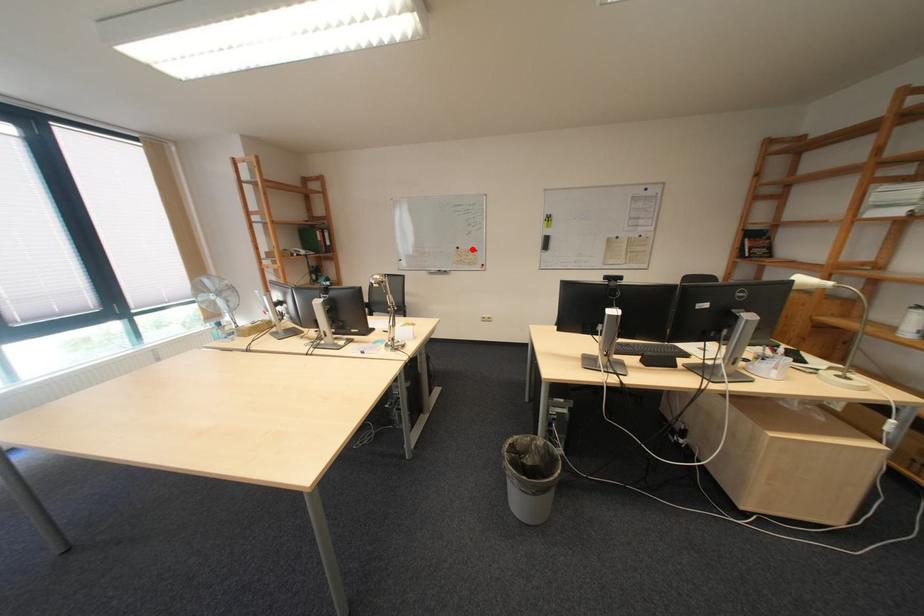
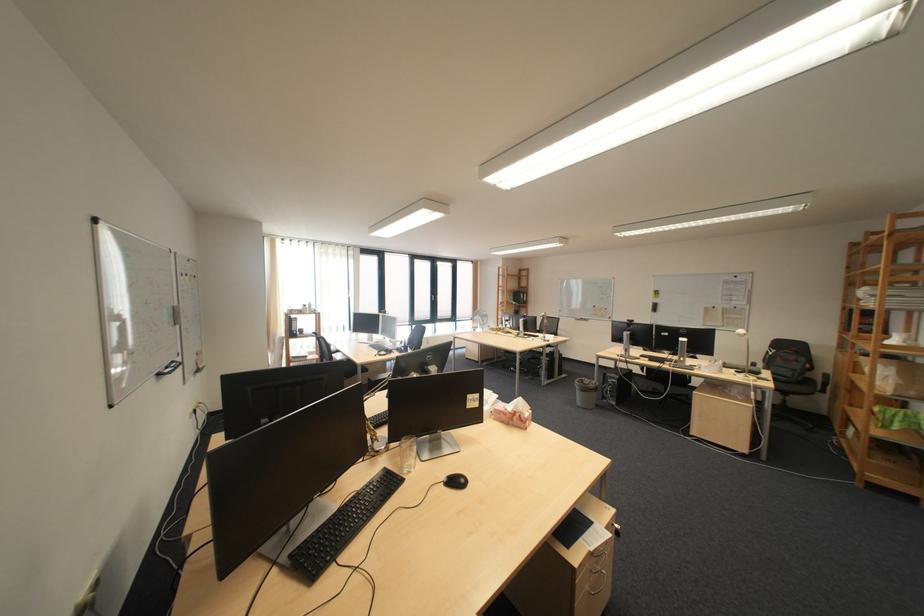
Locate, in the second image, the point that corresponds to the highlighted location in the first image.

(609, 308)